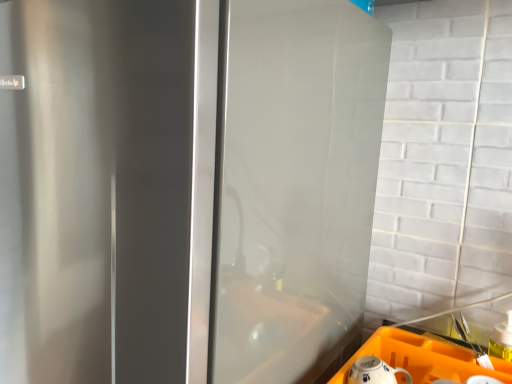
This screenshot has height=384, width=512. Describe the element at coordinates (423, 358) in the screenshot. I see `orange plastic tray at lower right` at that location.

Measure the distance between orange plastic tray at lower right and camera.

26.61 inches.

Identify the location of orange plastic tray at lower right. (423, 358).

In order to face orange plastic tray at lower right, should I rotate leftwards or rightwards?

Turn right by 21.417 degrees to look at orange plastic tray at lower right.

The image size is (512, 384). I want to click on orange plastic tray at lower right, so click(x=423, y=358).